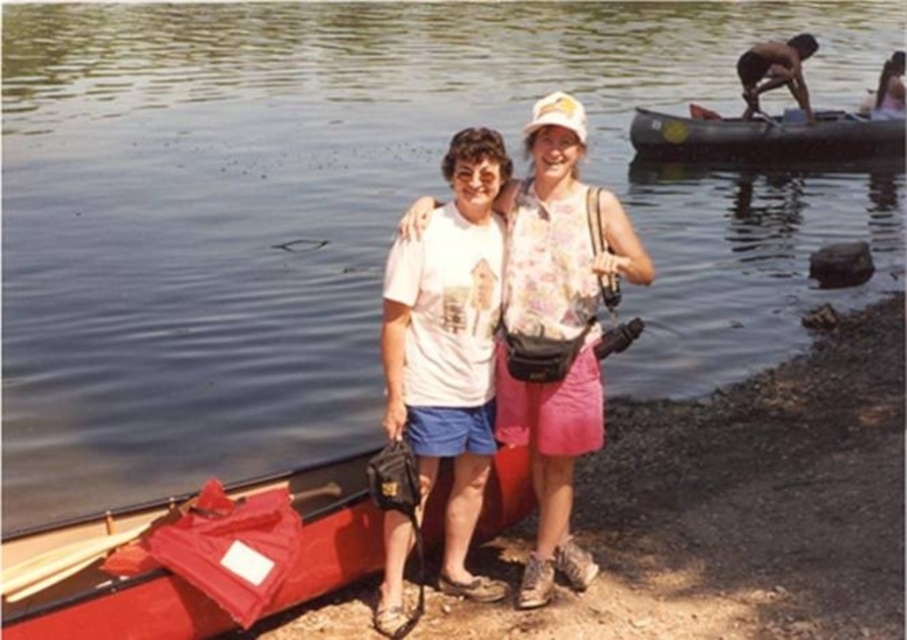
You are standing at the shore and want to take a photo of the skinny man at upper right without the rubberized black canoe at right blocking the view. Is it possible?

The skinny man at upper right is behind the rubberized black canoe at right, so the canoe is blocking the view of the man. Therefore, it is not possible to take a photo of the skinny man at upper right without the canoe blocking the view.

In the scene shown: You are taking a photo of the scene and want to focus on both point [511,301] and point [751,120]. Which point should you focus on first to ensure both are in focus?

Point [511,301] is closer to the camera than point [751,120]. To ensure both are in focus, focus on the closer point first, which is point [511,301].

You are standing at the point marked by the coordinates point [557,324]. Looking around, you see the white cotton shirt at center. Which direction should you walk to reach the white cotton shirt at center?

The point [557,324] is already at the location of the white cotton shirt at center, so you don not need to move.